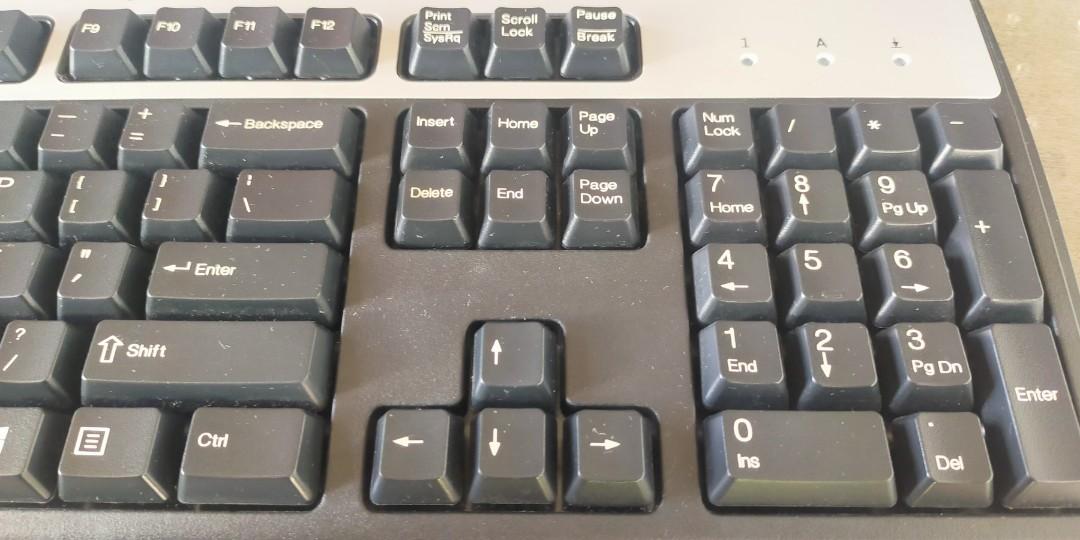
Find the location of `keyboard lights`. keyboard lights is located at coordinates (895, 64), (823, 64), (742, 62).